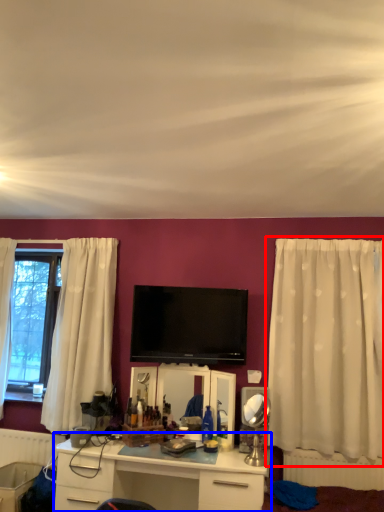
Question: Which object is further to the camera taking this photo, curtain (highlighted by a red box) or desk (highlighted by a blue box)?

Choices:
 (A) curtain
 (B) desk

Answer: (A)